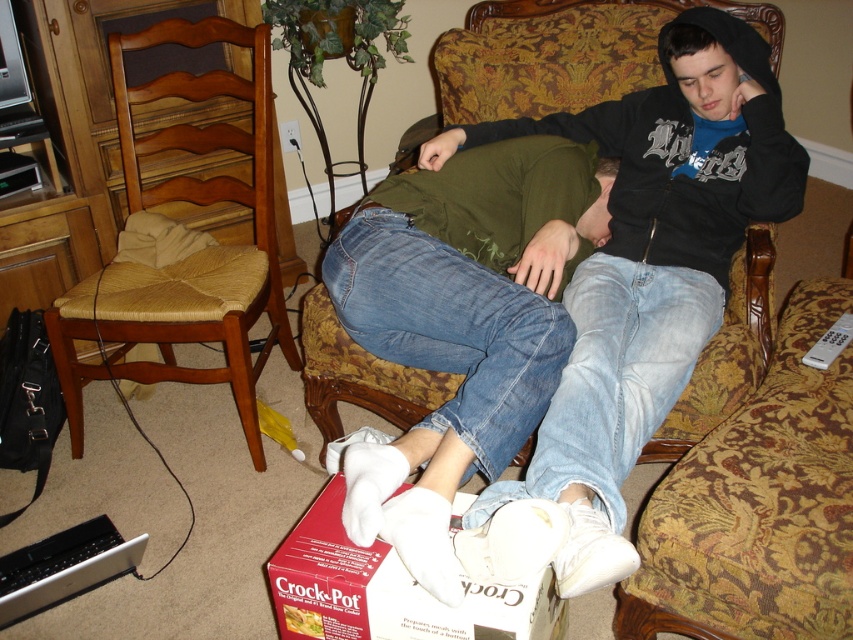
Which is below, white suede socks at lower center or white plastic remote at lower right?

Positioned lower is white suede socks at lower center.

Is white suede socks at lower center to the left of white plastic remote at lower right from the viewer's perspective?

Correct, you'll find white suede socks at lower center to the left of white plastic remote at lower right.

Between point (361, 541) and point (809, 360), which one is positioned in front?

Point (361, 541)

Where is `white suede socks at lower center`? The height and width of the screenshot is (640, 853). white suede socks at lower center is located at coordinates pyautogui.click(x=369, y=486).

Measure the distance between gold-patterned armchair at upper center and camera.

gold-patterned armchair at upper center is 1.88 meters away from camera.

Between point (633, 56) and point (518, 557), which one is positioned in front?

Point (518, 557) is more forward.

Where is `gold-patterned armchair at upper center`? The height and width of the screenshot is (640, 853). gold-patterned armchair at upper center is located at coordinates (556, 56).

Can you confirm if matte red crock-pot at lower center is thinner than white plastic remote at lower right?

Incorrect, matte red crock-pot at lower center's width is not less than white plastic remote at lower right's.

Between point (351, 577) and point (827, 353), which one is positioned in front?

Positioned in front is point (351, 577).

The image size is (853, 640). In order to click on matte red crock-pot at lower center in this screenshot , I will do `click(390, 589)`.